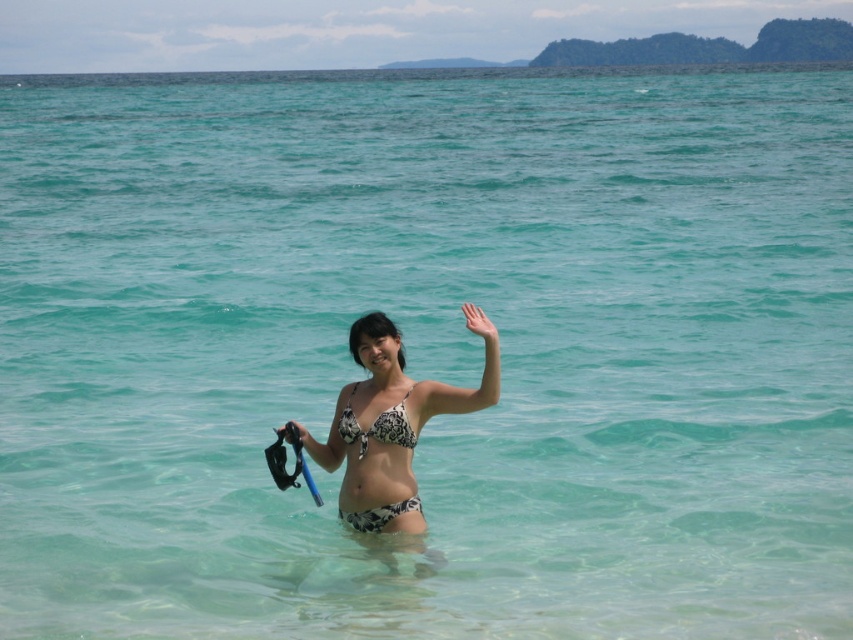
You are a lifeguard on duty and need to ensure the safety of swimmers. You observe a swimmer wearing a black printed bikini top at center holding a black rubber snorkel at center. Based on the distance between them, can you confirm if the snorkel is within a safe grasping distance for the swimmer?

The distance between the black printed bikini top at center and the black rubber snorkel at center is 19.84 inches, which is within a typical safe grasping range for a swimmer to hold the snorkel securely.

You are a photographer taking a picture of the beach scene. You notice the black printed bikini top at center and the blue rubber paddle at center. Which object is positioned closer to the camera?

The black printed bikini top at center is closer to the viewer than the blue rubber paddle at center, so it will appear closer to the camera in the photo.

You are a photographer capturing the beach scene. You notice the white printed bikini at center and the black printed bikini top at center. Which one is positioned higher on the person?

The white printed bikini at center is above the black printed bikini top at center, so the white printed bikini at center is positioned higher on the person.